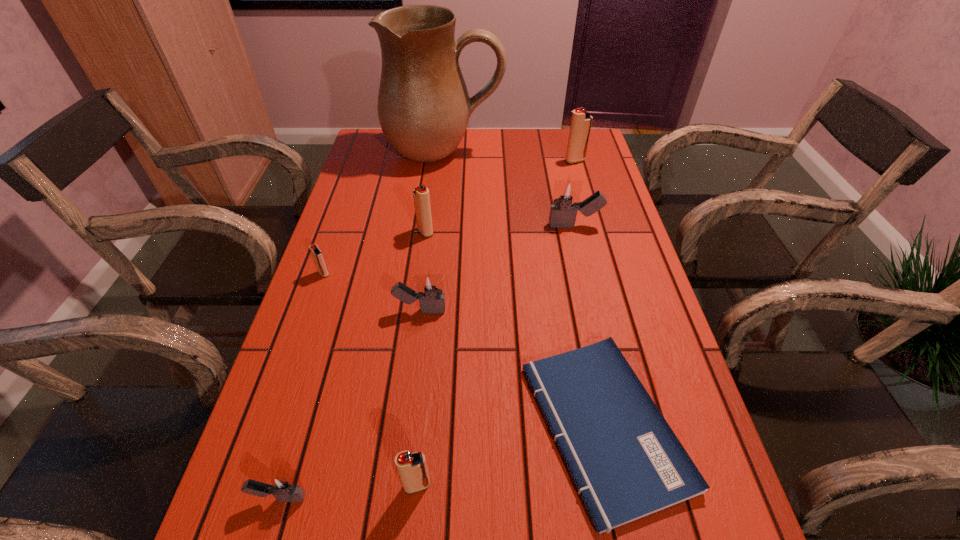
Where is `the tallest object`? This screenshot has width=960, height=540. the tallest object is located at coordinates (424, 107).

Where is `the farthest red igniter`? The height and width of the screenshot is (540, 960). the farthest red igniter is located at coordinates (581, 121).

I want to click on the tallest igniter, so click(x=581, y=121).

This screenshot has height=540, width=960. I want to click on the third nearest red igniter, so (x=421, y=197).

This screenshot has width=960, height=540. I want to click on the farthest gray igniter, so click(566, 194).

Identify the location of the biggest gray igniter. (566, 194).

Identify the location of the third nearest igniter. (430, 291).

The height and width of the screenshot is (540, 960). I want to click on the fourth nearest object, so click(x=430, y=291).

The height and width of the screenshot is (540, 960). Find the location of `the nearest red igniter`. the nearest red igniter is located at coordinates (412, 468).

This screenshot has width=960, height=540. Identify the location of the third farthest red igniter. (318, 257).